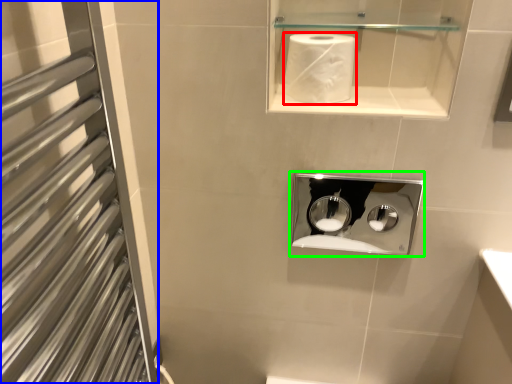
Question: Which object is positioned closest to paper towel (highlighted by a red box)? Select from screen door (highlighted by a blue box) and medicine cabinet (highlighted by a green box).

Choices:
 (A) screen door
 (B) medicine cabinet

Answer: (A)